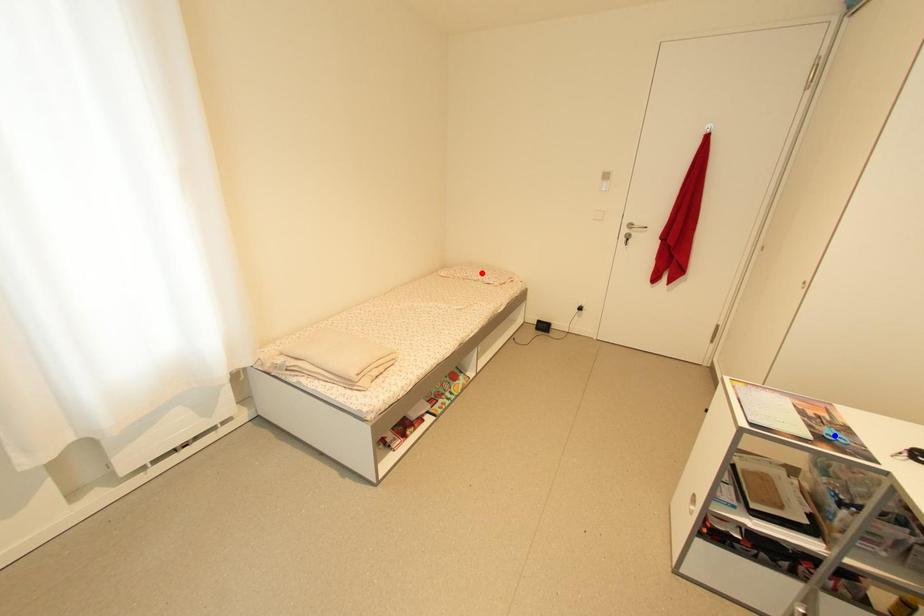
Question: In the image, two points are highlighted. Which point is nearer to the camera? Reply with the corresponding letter.

Choices:
 (A) blue point
 (B) red point

Answer: (A)